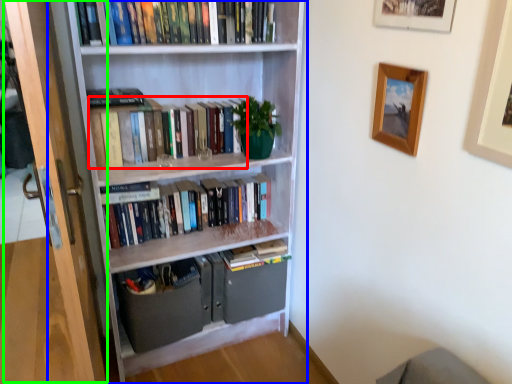
Question: Considering the real-world distances, which object is closest to book (highlighted by a red box)? bookcase (highlighted by a blue box) or screen door (highlighted by a green box).

Choices:
 (A) bookcase
 (B) screen door

Answer: (A)